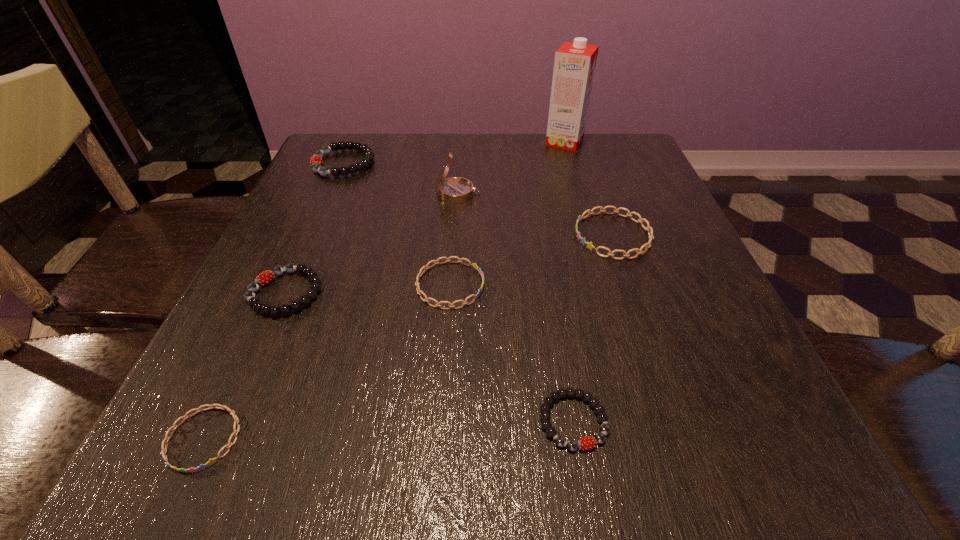
Identify the location of bracelet that is the fifth closest to the second tallest object. The height and width of the screenshot is (540, 960). (599, 438).

Locate an element on the screen. black bracelet that stands as the second closest to the rightmost black bracelet is located at coordinates (316, 160).

Point out which black bracelet is positioned as the second nearest to the second farthest bracelet. Please provide its 2D coordinates. Your answer should be formatted as a tuple, i.e. [(x, y)], where the tuple contains the x and y coordinates of a point satisfying the conditions above.

[(266, 277)]

Locate which blue bracelet ranks in proximity to the second biggest black bracelet. Please provide its 2D coordinates. Your answer should be formatted as a tuple, i.e. [(x, y)], where the tuple contains the x and y coordinates of a point satisfying the conditions above.

[(166, 439)]

Point out which blue bracelet is positioned as the nearest to the shortest object. Please provide its 2D coordinates. Your answer should be formatted as a tuple, i.e. [(x, y)], where the tuple contains the x and y coordinates of a point satisfying the conditions above.

[(475, 266)]

Image resolution: width=960 pixels, height=540 pixels. Find the location of `free location that satisfies the following two spatial constraints: 1. on the surface of the biggest blue bracelet showing star-shaped elements; 2. on the front side of the nearest black bracelet`. free location that satisfies the following two spatial constraints: 1. on the surface of the biggest blue bracelet showing star-shaped elements; 2. on the front side of the nearest black bracelet is located at coordinates (677, 421).

Where is `vacant space that satisfies the following two spatial constraints: 1. on the surface of the farthest blue bracelet showing star-shaped elements; 2. on the surface of the smallest blue bracelet showing star-shaped elements`? Image resolution: width=960 pixels, height=540 pixels. vacant space that satisfies the following two spatial constraints: 1. on the surface of the farthest blue bracelet showing star-shaped elements; 2. on the surface of the smallest blue bracelet showing star-shaped elements is located at coordinates click(684, 438).

You are a GUI agent. You are given a task and a screenshot of the screen. Output one action in this format:
    pyautogui.click(x=<x>, y=<y>)
    Task: Click on the free space that satisfies the following two spatial constraints: 1. on the surface of the fourth bracelet from left to right showing star-shaped elements; 2. on the right side of the nearest black bracelet
    
    Given the screenshot: What is the action you would take?
    pyautogui.click(x=441, y=421)